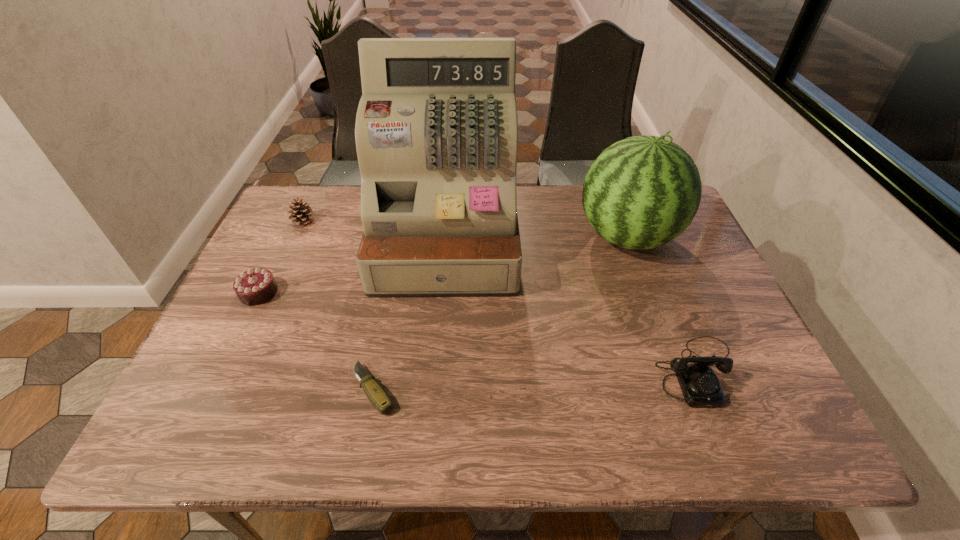
Find the location of a particular element. vacant space that is in between the pocketknife and the fifth tallest object is located at coordinates (316, 341).

You are a GUI agent. You are given a task and a screenshot of the screen. Output one action in this format:
    pyautogui.click(x=<x>, y=<y>)
    Task: Click on the unoccupied area between the shortest object and the cash register
    This screenshot has height=540, width=960.
    Given the screenshot: What is the action you would take?
    pyautogui.click(x=410, y=314)

At what (x,y) coordinates should I click in order to perform the action: click on free space between the pocketknife and the watermelon. Please return your answer as a coordinate pair (x, y). This screenshot has width=960, height=540. Looking at the image, I should click on (500, 313).

You are a GUI agent. You are given a task and a screenshot of the screen. Output one action in this format:
    pyautogui.click(x=<x>, y=<y>)
    Task: Click on the vacant region between the pocketknife and the fifth shortest object
    
    Given the screenshot: What is the action you would take?
    pyautogui.click(x=500, y=313)

You are a GUI agent. You are given a task and a screenshot of the screen. Output one action in this format:
    pyautogui.click(x=<x>, y=<y>)
    Task: Click on the free spot between the cash register and the shortest object
    This screenshot has width=960, height=540.
    Given the screenshot: What is the action you would take?
    pyautogui.click(x=410, y=314)

Identify the location of unoccupied position between the telephone and the cash register. The image size is (960, 540). coord(570,304).

Locate an element on the screen. This screenshot has width=960, height=540. object that is the third closest to the second shortest object is located at coordinates (375, 393).

Locate which object ranks fourth in proximity to the second shortest object. Please provide its 2D coordinates. Your answer should be formatted as a tuple, i.e. [(x, y)], where the tuple contains the x and y coordinates of a point satisfying the conditions above.

[(642, 192)]

Where is `vacant point that satisfies the following two spatial constraints: 1. on the back side of the fifth tallest object; 2. on the right side of the pinecone`? vacant point that satisfies the following two spatial constraints: 1. on the back side of the fifth tallest object; 2. on the right side of the pinecone is located at coordinates (293, 221).

The width and height of the screenshot is (960, 540). What are the coordinates of `vacant space that satisfies the following two spatial constraints: 1. on the front side of the watermelon; 2. on the left side of the pinecone` in the screenshot? It's located at (295, 237).